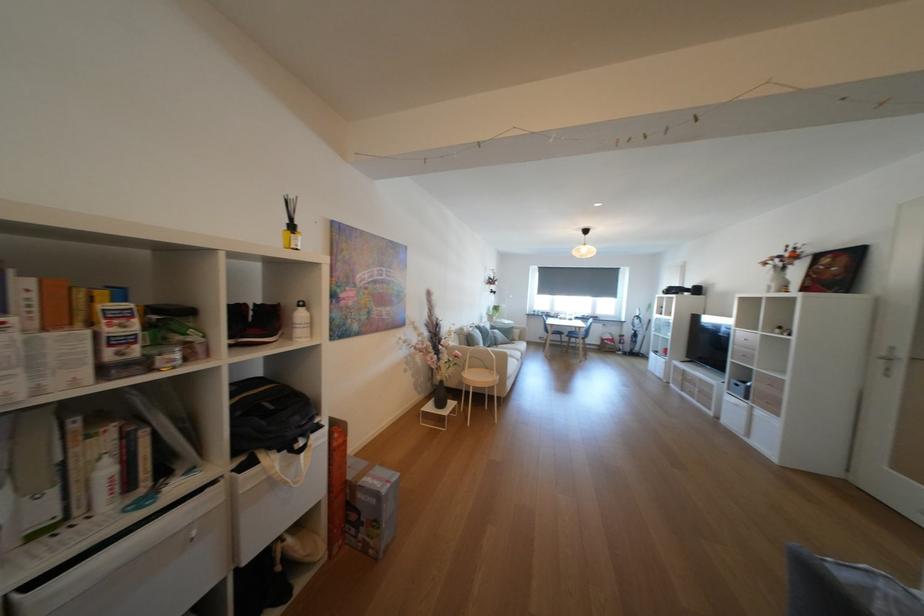
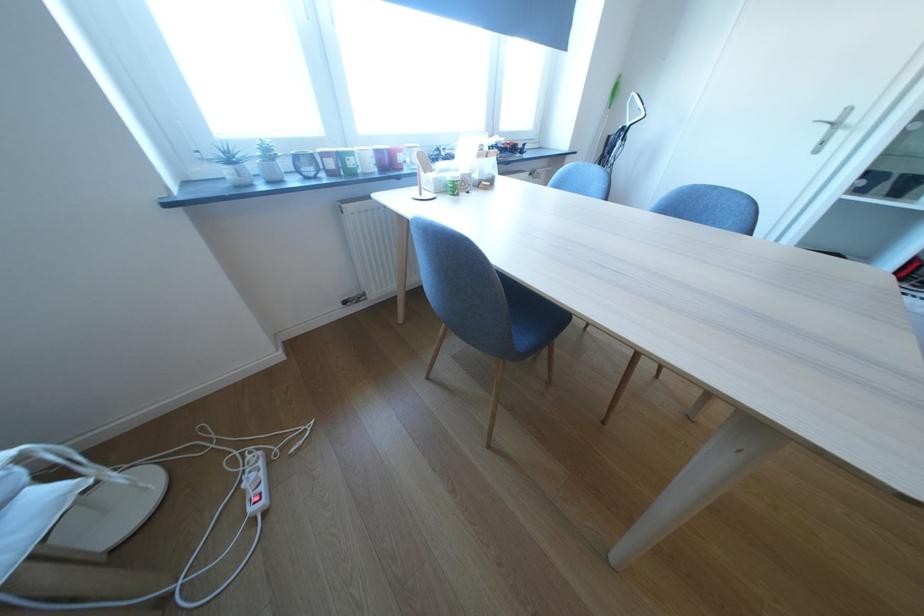
In the second image, find the point that corresponds to [553,314] in the first image.

(308, 160)